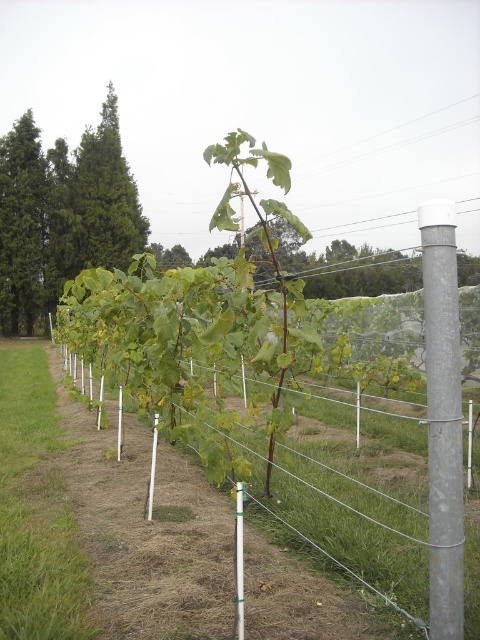
Question: Which of the following is the farthest from the observer?

Choices:
 (A) [236, 614]
 (B) [423, 532]
 (C) [427, 214]
 (D) [103, 221]

Answer: (D)

Question: Which of these objects is positioned closest to the green textured tree at upper left?

Choices:
 (A) green matte tree at upper left
 (B) galvanized metal pole at right
 (C) wire mesh fence at center
 (D) silver metallic pole at center

Answer: (A)

Question: Is green textured tree at upper left positioned at the back of galvanized metal pole at right?

Choices:
 (A) yes
 (B) no

Answer: (A)

Question: Can you confirm if wire mesh fence at center is bigger than green matte tree at upper left?

Choices:
 (A) yes
 (B) no

Answer: (B)

Question: Which of the following is the closest to the observer?

Choices:
 (A) (309, 481)
 (B) (440, 449)
 (C) (236, 493)

Answer: (B)

Question: Is galvanized metal pole at right in front of green matte tree at upper left?

Choices:
 (A) no
 (B) yes

Answer: (B)